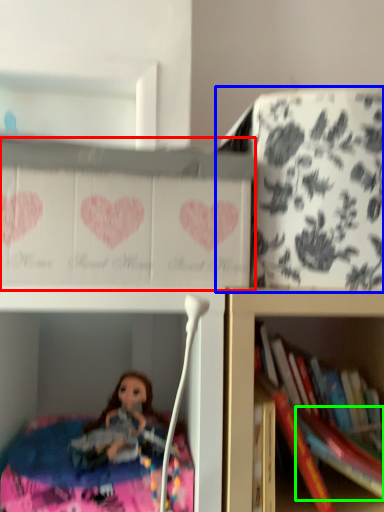
Question: Which object is the farthest from cabinet (highlighted by a red box)? Choose among these: cabinet (highlighted by a blue box) or book (highlighted by a green box).

Choices:
 (A) cabinet
 (B) book

Answer: (B)